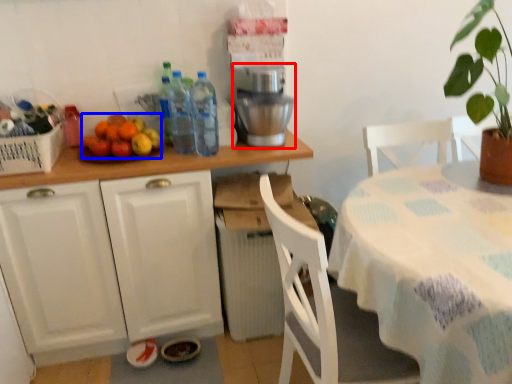
Question: Which point is closer to the camera, coffee machine (highlighted by a red box) or fruit (highlighted by a blue box)?

Choices:
 (A) coffee machine
 (B) fruit

Answer: (B)